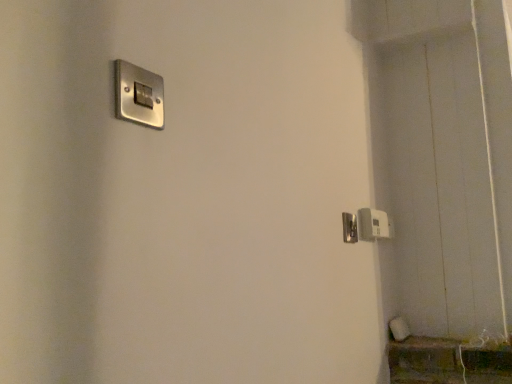
Question: Should I look upward or downward to see white plastic light switch at lower right, positioned as the second light switch in front-to-back order?

Choices:
 (A) down
 (B) up

Answer: (A)

Question: Would you consider white plastic light switch at lower right, positioned as the second light switch in front-to-back order, to be distant from satin nickel door handle at right?

Choices:
 (A) no
 (B) yes

Answer: (A)

Question: Does white plastic light switch at lower right, the first light switch positioned from the back, have a lesser height compared to satin nickel door handle at right?

Choices:
 (A) no
 (B) yes

Answer: (A)

Question: Does white plastic light switch at lower right, arranged as the second light switch when viewed from the top, have a greater height compared to satin nickel door handle at right?

Choices:
 (A) yes
 (B) no

Answer: (A)

Question: Is white plastic light switch at lower right, the first light switch from the bottom, oriented towards satin nickel door handle at right?

Choices:
 (A) yes
 (B) no

Answer: (B)

Question: From a real-world perspective, is white plastic light switch at lower right, arranged as the second light switch when viewed from the top, under satin nickel door handle at right?

Choices:
 (A) yes
 (B) no

Answer: (B)

Question: From a real-world perspective, is white plastic light switch at lower right, the first light switch from the bottom, over satin nickel door handle at right?

Choices:
 (A) yes
 (B) no

Answer: (A)

Question: Is satin nickel door handle at right not inside white plastic light switch at lower right, the 1th light switch in the right-to-left sequence?

Choices:
 (A) yes
 (B) no

Answer: (A)

Question: Is satin nickel door handle at right further to camera compared to white plastic light switch at lower right, positioned as the 2th light switch in left-to-right order?

Choices:
 (A) yes
 (B) no

Answer: (B)

Question: Does satin nickel door handle at right have a greater width compared to white plastic light switch at lower right, arranged as the second light switch when viewed from the top?

Choices:
 (A) no
 (B) yes

Answer: (A)

Question: From the image's perspective, is satin nickel door handle at right under white plastic light switch at lower right, the first light switch positioned from the back?

Choices:
 (A) yes
 (B) no

Answer: (B)

Question: Is satin nickel door handle at right taller than white plastic light switch at lower right, arranged as the second light switch when viewed from the top?

Choices:
 (A) yes
 (B) no

Answer: (B)

Question: Is satin nickel door handle at right turned away from white plastic light switch at lower right, positioned as the 2th light switch in left-to-right order?

Choices:
 (A) no
 (B) yes

Answer: (A)

Question: Can you confirm if white plastic light switch at lower right, the first light switch from the bottom, is shorter than satin silver switch at upper left, positioned as the second light switch in right-to-left order?

Choices:
 (A) no
 (B) yes

Answer: (A)